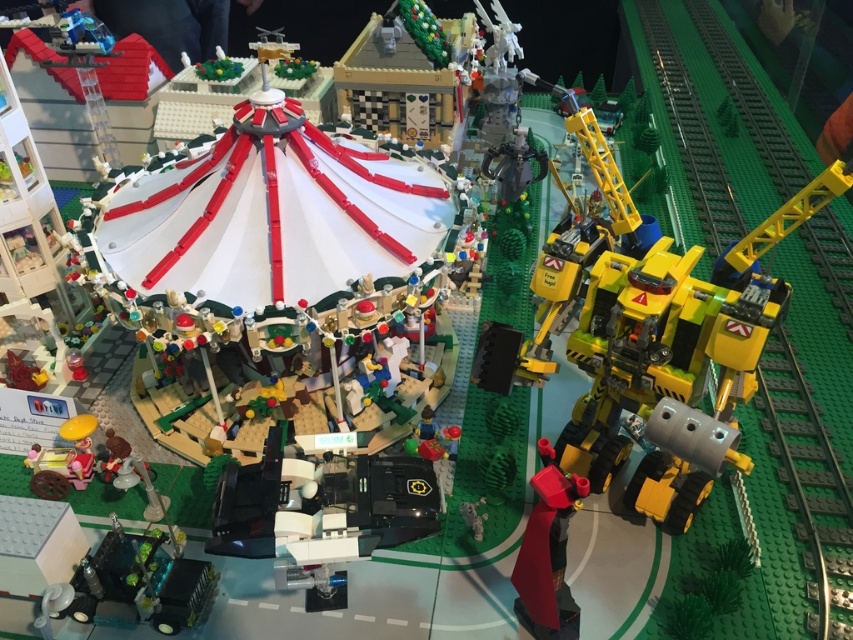
Is green plastic train track at right above smooth red cape at center?

Yes.

In the scene shown: Measure the distance from green plastic train track at right to smooth red cape at center.

The distance of green plastic train track at right from smooth red cape at center is 30.66 inches.

This screenshot has height=640, width=853. What do you see at coordinates (715, 118) in the screenshot?
I see `green plastic train track at right` at bounding box center [715, 118].

What are the coordinates of `green plastic train track at right` in the screenshot? It's located at (715, 118).